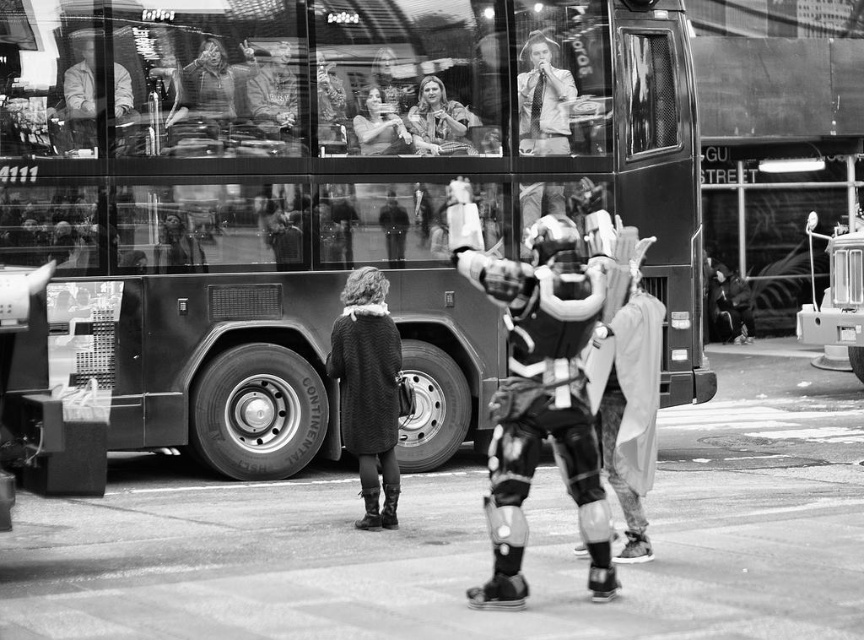
Question: Which object is positioned closest to the knitted wool coat at center?

Choices:
 (A) matte black jacket at upper left
 (B) metallic silver armor at center

Answer: (B)

Question: Among these points, which one is nearest to the camera?

Choices:
 (A) (329, 355)
 (B) (599, 305)
 (C) (613, 477)

Answer: (B)

Question: Does metallic silver armor at center have a greater width compared to matte black jacket at upper left?

Choices:
 (A) no
 (B) yes

Answer: (B)

Question: Does metallic armor suit at center appear over metallic silver armor at center?

Choices:
 (A) yes
 (B) no

Answer: (A)

Question: Which object is the closest to the metallic armor suit at center?

Choices:
 (A) matte black jacket at upper center
 (B) knitted wool coat at center
 (C) metallic silver armor at center
 (D) matte black jacket at upper left

Answer: (C)

Question: Does metallic armor suit at center have a smaller size compared to knitted wool coat at center?

Choices:
 (A) yes
 (B) no

Answer: (B)